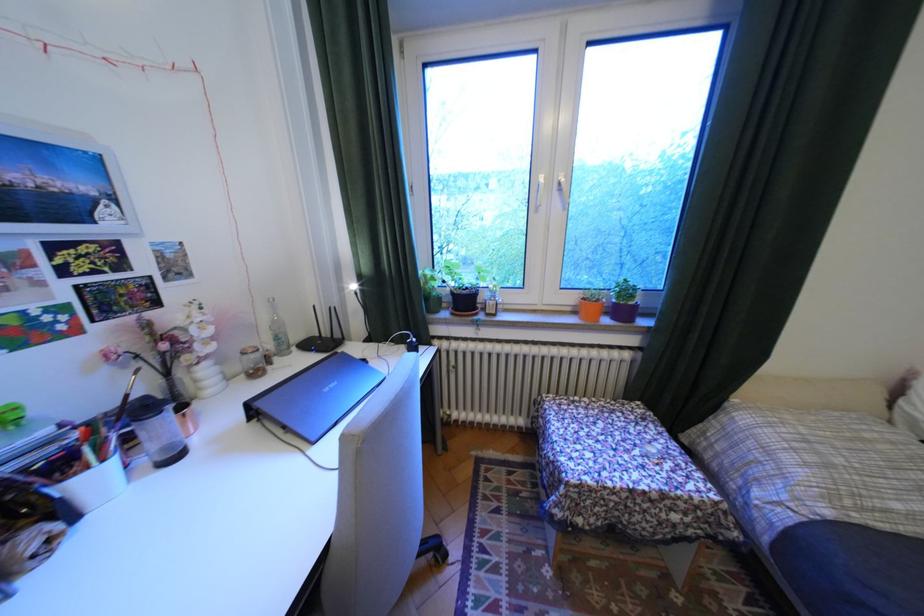
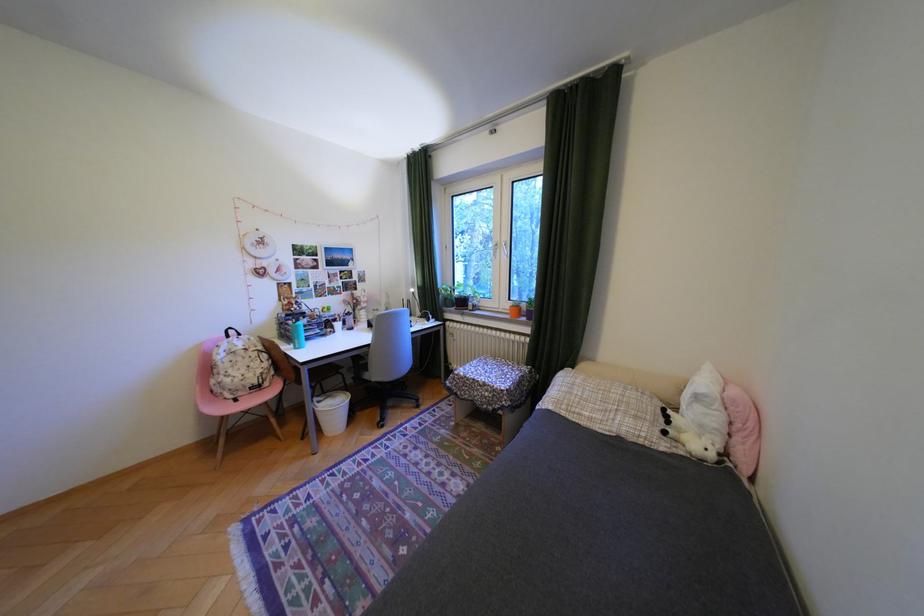
Where in the second image is the point corresponding to (x=591, y=521) from the first image?

(470, 392)